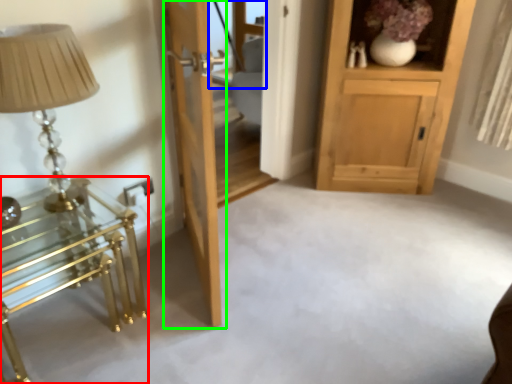
Question: Considering the real-world distances, which object is closest to table (highlighted by a red box)? glass door (highlighted by a blue box) or door (highlighted by a green box).

Choices:
 (A) glass door
 (B) door

Answer: (B)